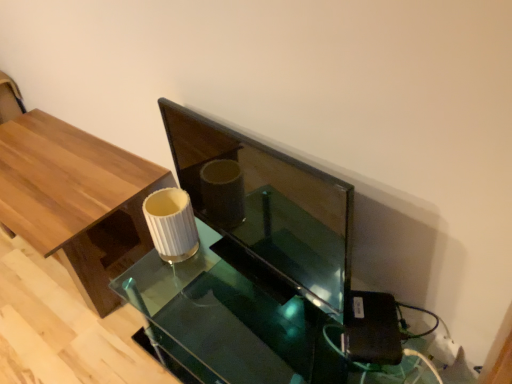
Question: Is translucent glass table at center behind wooden table at left?

Choices:
 (A) yes
 (B) no

Answer: (B)

Question: Considering the relative sizes of translucent glass table at center and wooden table at left in the image provided, is translucent glass table at center thinner than wooden table at left?

Choices:
 (A) yes
 (B) no

Answer: (A)

Question: Would you consider translucent glass table at center to be distant from wooden table at left?

Choices:
 (A) yes
 (B) no

Answer: (B)

Question: From a real-world perspective, is translucent glass table at center positioned over wooden table at left based on gravity?

Choices:
 (A) no
 (B) yes

Answer: (A)

Question: Does translucent glass table at center appear on the left side of wooden table at left?

Choices:
 (A) yes
 (B) no

Answer: (B)

Question: Can you see translucent glass table at center touching wooden table at left?

Choices:
 (A) no
 (B) yes

Answer: (A)

Question: From the image's perspective, is wooden table at left beneath translucent glass table at center?

Choices:
 (A) yes
 (B) no

Answer: (B)

Question: Does wooden table at left have a larger size compared to translucent glass table at center?

Choices:
 (A) no
 (B) yes

Answer: (B)

Question: Is wooden table at left in contact with translucent glass table at center?

Choices:
 (A) yes
 (B) no

Answer: (B)

Question: Would you say translucent glass table at center is part of wooden table at left's contents?

Choices:
 (A) yes
 (B) no

Answer: (B)

Question: From the image's perspective, is wooden table at left on translucent glass table at center?

Choices:
 (A) no
 (B) yes

Answer: (B)

Question: Is wooden table at left completely or partially outside of translucent glass table at center?

Choices:
 (A) no
 (B) yes

Answer: (B)

Question: Is translucent glass table at center taller or shorter than wooden table at left?

Choices:
 (A) tall
 (B) short

Answer: (B)